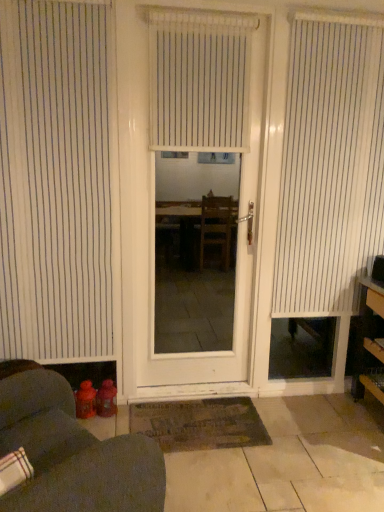
Question: Is point (235, 80) closer or farther from the camera than point (370, 294)?

Choices:
 (A) closer
 (B) farther

Answer: (A)

Question: Would you say white vertical blinds at center, which ranks as the second window blind in left-to-right order, is to the left or to the right of wooden shelves at right in the picture?

Choices:
 (A) left
 (B) right

Answer: (A)

Question: Which is nearer to the white vertical blinds at center, which ranks as the second window blind in left-to-right order?

Choices:
 (A) matte red water bottles at lower left
 (B) white matte door at center
 (C) white vertical blinds at right, the 3th window blind positioned from the left
 (D) dark brown textured mat at center
 (E) wooden shelves at right

Answer: (C)

Question: Considering the real-world distances, which object is farthest from the matte red water bottles at lower left?

Choices:
 (A) white striped blind at lower left, arranged as the third window blind when viewed from the right
 (B) wooden shelves at right
 (C) white vertical blinds at center, which ranks as the second window blind in left-to-right order
 (D) white matte door at center
 (E) dark brown textured mat at center

Answer: (D)